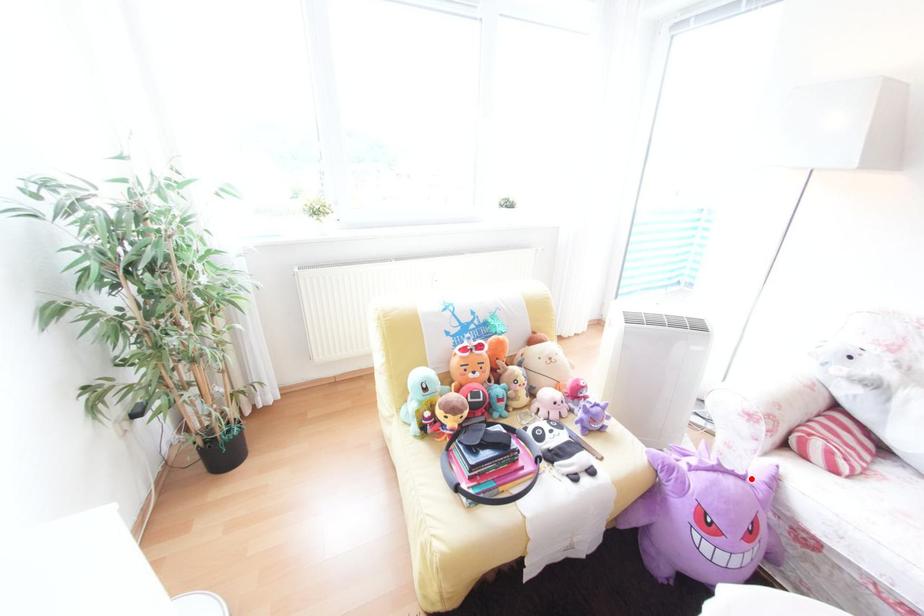
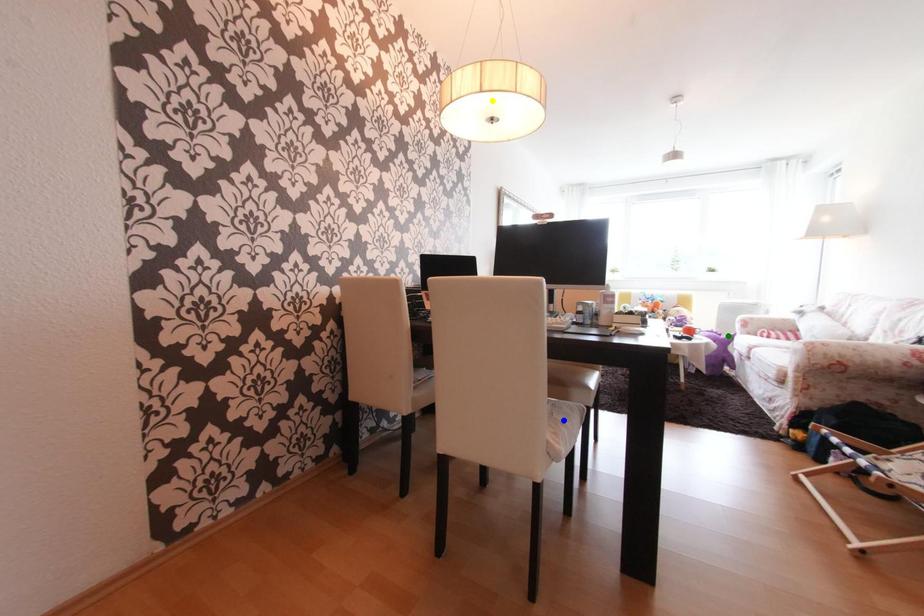
Question: I am providing you with two images of the same scene from different viewpoints. A red point is marked on the first image. You are given multiple points on the second image. Which spot in image 2 lines up with the point in image 1?

Choices:
 (A) yellow point
 (B) green point
 (C) blue point

Answer: (B)